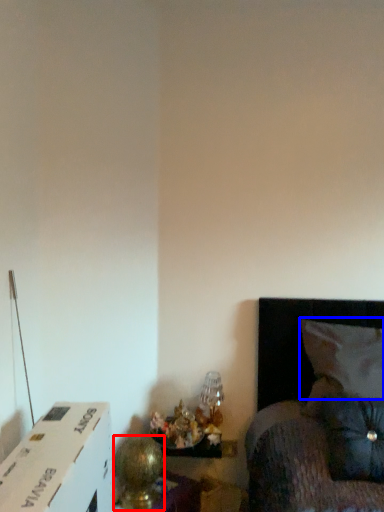
Question: Which object appears farthest to the camera in this image, table lamp (highlighted by a red box) or pillow (highlighted by a blue box)?

Choices:
 (A) table lamp
 (B) pillow

Answer: (B)